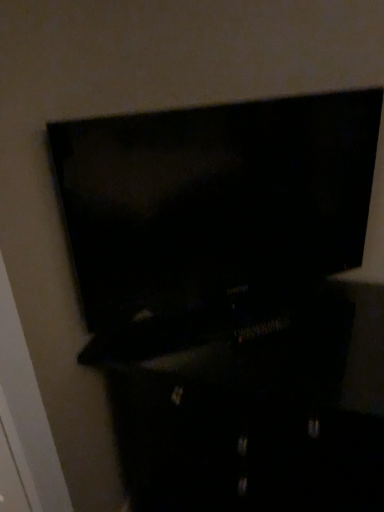
Question: Relative to black glossy dresser at center, is matte black tv at upper center in front or behind?

Choices:
 (A) front
 (B) behind

Answer: (A)

Question: In terms of width, does matte black tv at upper center look wider or thinner when compared to black glossy dresser at center?

Choices:
 (A) wide
 (B) thin

Answer: (B)

Question: Is matte black tv at upper center inside or outside of black glossy dresser at center?

Choices:
 (A) inside
 (B) outside

Answer: (B)

Question: Visually, is black glossy dresser at center positioned to the left or to the right of matte black tv at upper center?

Choices:
 (A) right
 (B) left

Answer: (A)

Question: Considering the positions of black glossy dresser at center and matte black tv at upper center in the image, is black glossy dresser at center taller or shorter than matte black tv at upper center?

Choices:
 (A) short
 (B) tall

Answer: (B)

Question: From the image's perspective, is black glossy dresser at center located above or below matte black tv at upper center?

Choices:
 (A) above
 (B) below

Answer: (B)

Question: Based on their sizes in the image, would you say black glossy dresser at center is bigger or smaller than matte black tv at upper center?

Choices:
 (A) small
 (B) big

Answer: (B)